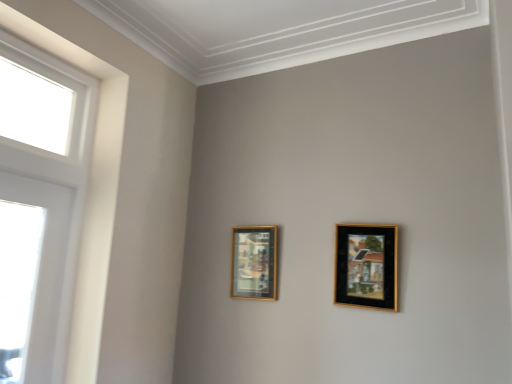
Question: Is gold-framed picture at center-left, which appears as the second picture frame when viewed from the right, wider or thinner than black matte picture frame at upper right, the 2th picture frame viewed from the back?

Choices:
 (A) thin
 (B) wide

Answer: (B)

Question: From a real-world perspective, relative to black matte picture frame at upper right, which is counted as the 2th picture frame, starting from the left, is gold-framed picture at center-left, placed as the first picture frame when sorted from left to right, vertically above or below?

Choices:
 (A) below
 (B) above

Answer: (A)

Question: Based on their relative distances, which object is farther from the gold-framed picture at center-left, placed as the first picture frame when sorted from left to right?

Choices:
 (A) black matte picture frame at upper right, the 1th picture frame when ordered from right to left
 (B) white glossy window at left

Answer: (B)

Question: Based on their relative distances, which object is nearer to the white glossy window at left?

Choices:
 (A) black matte picture frame at upper right, the 1th picture frame when ordered from right to left
 (B) gold-framed picture at center-left, placed as the first picture frame when sorted from left to right

Answer: (B)